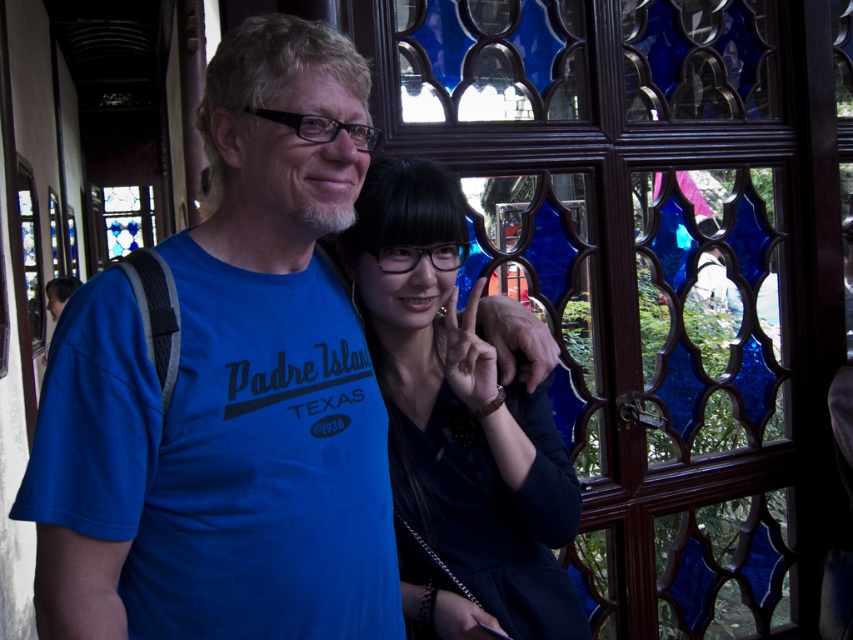
Question: Which point is closer to the camera?

Choices:
 (A) (573, 419)
 (B) (137, 227)

Answer: (A)

Question: Which of these objects is positioned closest to the blue cotton t-shirt at center?

Choices:
 (A) blue stained glass at center
 (B) matte black jacket at center
 (C) stained glass window at upper left

Answer: (B)

Question: Is blue stained glass at center bigger than blue cotton t-shirt at center?

Choices:
 (A) no
 (B) yes

Answer: (B)

Question: Can you confirm if blue stained glass at center is smaller than blue cotton t-shirt at center?

Choices:
 (A) no
 (B) yes

Answer: (A)

Question: Which point appears farthest from the camera in this image?

Choices:
 (A) (416, 58)
 (B) (181, 467)

Answer: (A)

Question: Does blue stained glass at center appear under stained glass window at upper left?

Choices:
 (A) yes
 (B) no

Answer: (A)